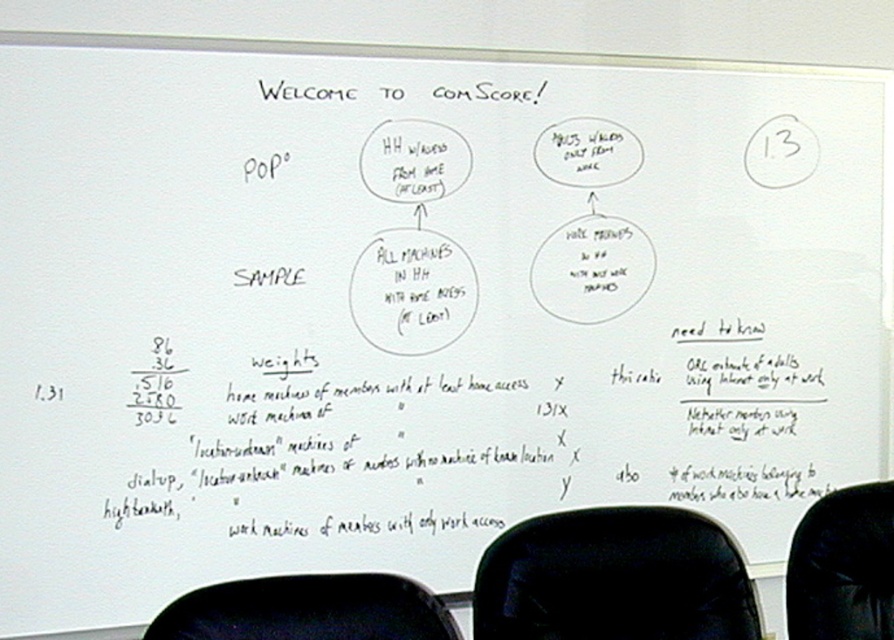
Question: Among these points, which one is nearest to the camera?

Choices:
 (A) (188, 611)
 (B) (741, 616)
 (C) (823, 625)

Answer: (A)

Question: Does black fabric armchair at lower center appear on the right side of black fabric armchair at lower right?

Choices:
 (A) no
 (B) yes

Answer: (A)

Question: Estimate the real-world distances between objects in this image. Which object is farther from the black fabric swivel chair at lower center?

Choices:
 (A) black fabric armchair at lower right
 (B) black fabric armchair at lower center

Answer: (B)

Question: Can you confirm if black fabric swivel chair at lower center is bigger than black fabric armchair at lower right?

Choices:
 (A) yes
 (B) no

Answer: (A)

Question: Which object is the closest to the black fabric armchair at lower center?

Choices:
 (A) black fabric armchair at lower right
 (B) black fabric swivel chair at lower center

Answer: (B)

Question: Observing the image, what is the correct spatial positioning of black fabric swivel chair at lower center in reference to black fabric armchair at lower center?

Choices:
 (A) below
 (B) above

Answer: (A)